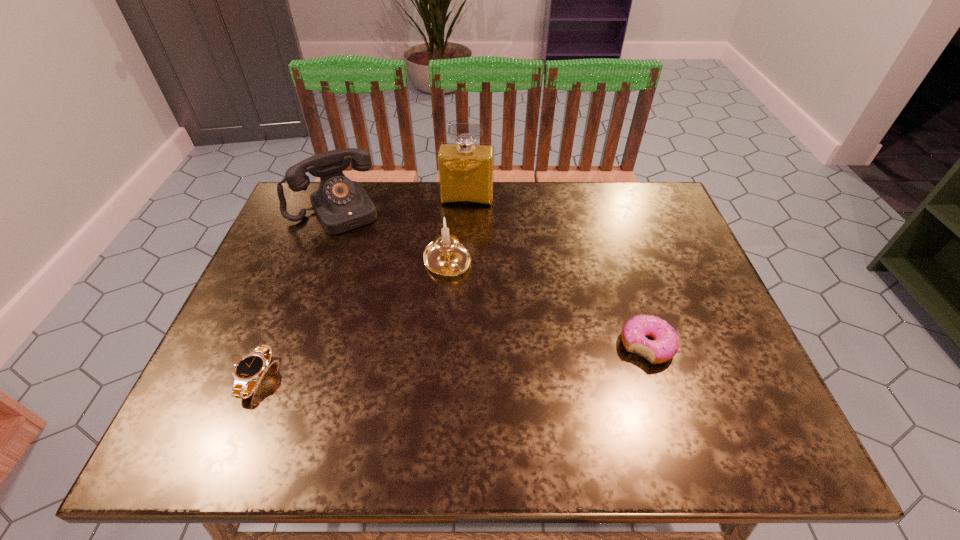
Where is `free space on the desktop that is between the watch and the rightmost object and is positioned on the handle side of the third nearest object`? The image size is (960, 540). free space on the desktop that is between the watch and the rightmost object and is positioned on the handle side of the third nearest object is located at coordinates (511, 357).

You are a GUI agent. You are given a task and a screenshot of the screen. Output one action in this format:
    pyautogui.click(x=<x>, y=<y>)
    Task: Click on the vacant space on the desktop that is between the watch and the rightmost object and is positioned on the front-facing side of the tallest object
    
    Given the screenshot: What is the action you would take?
    pyautogui.click(x=446, y=362)

The image size is (960, 540). Find the location of `free spot on the desktop that is between the shortest object and the doughnut and is positioned on the dial of the telephone`. free spot on the desktop that is between the shortest object and the doughnut and is positioned on the dial of the telephone is located at coordinates (425, 364).